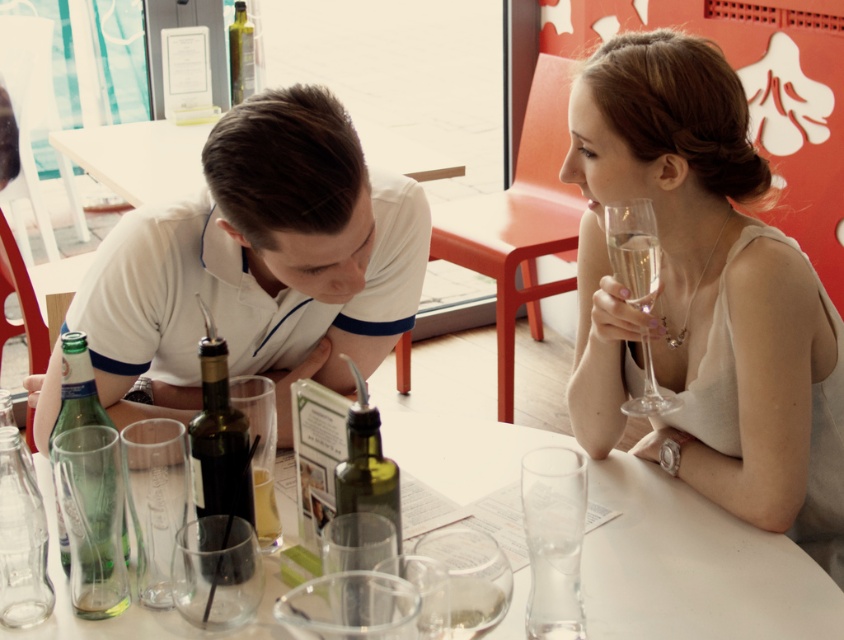
Question: Can you confirm if clear glassware at center is positioned to the left of translucent glass at table center?

Choices:
 (A) yes
 (B) no

Answer: (B)

Question: Does green glass bottle at center lie behind green glass bottle at upper center?

Choices:
 (A) no
 (B) yes

Answer: (A)

Question: Does white matte shirt at center appear over dark green glass bottle at center?

Choices:
 (A) no
 (B) yes

Answer: (B)

Question: Among these points, which one is farthest from the camera?

Choices:
 (A) (212, 509)
 (B) (247, 84)
 (C) (269, 524)

Answer: (B)

Question: Among these objects, which one is nearest to the camera?

Choices:
 (A) green glass bottle at upper center
 (B) green glass bottle at lower left
 (C) green glass bottle at center
 (D) white matte shirt at center

Answer: (C)

Question: Which point is closer to the camera?

Choices:
 (A) white matte shirt at center
 (B) green glass bottle at center
 (C) clear crystal wine glass at upper right

Answer: (B)